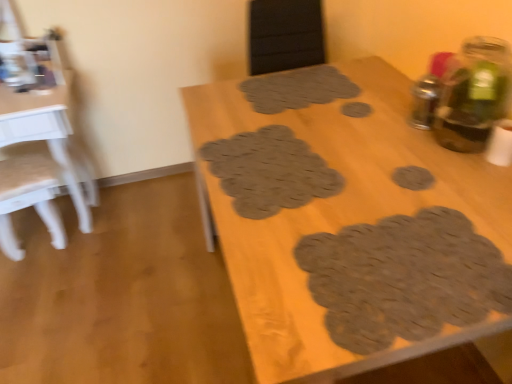
Identify the location of empty space that is ontop of brown textured mat at center, which appears as the 4th footprint when viewed from the back (from a real-world perspective). Image resolution: width=512 pixels, height=384 pixels. (267, 167).